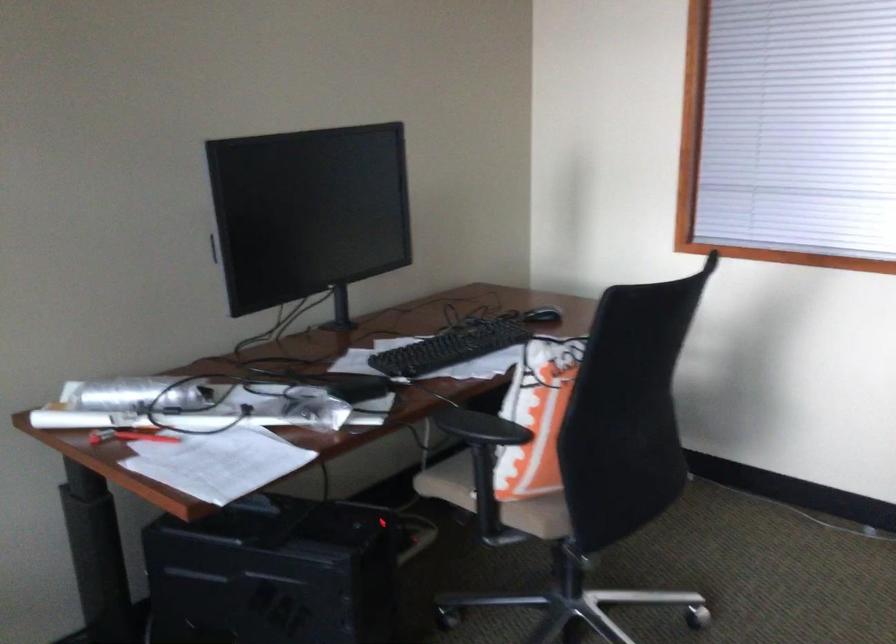
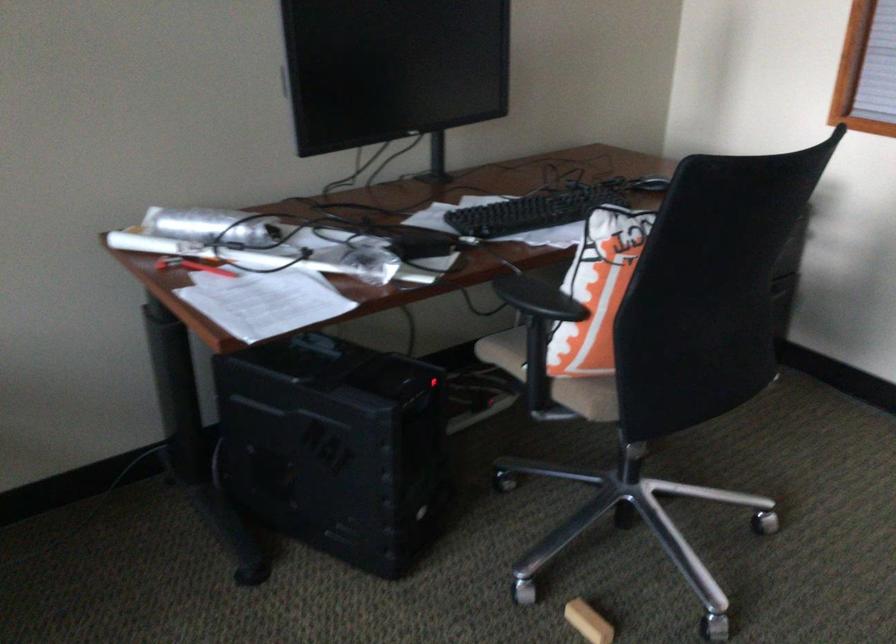
Where in the second image is the point corresponding to point 543,412 from the first image?

(597, 290)